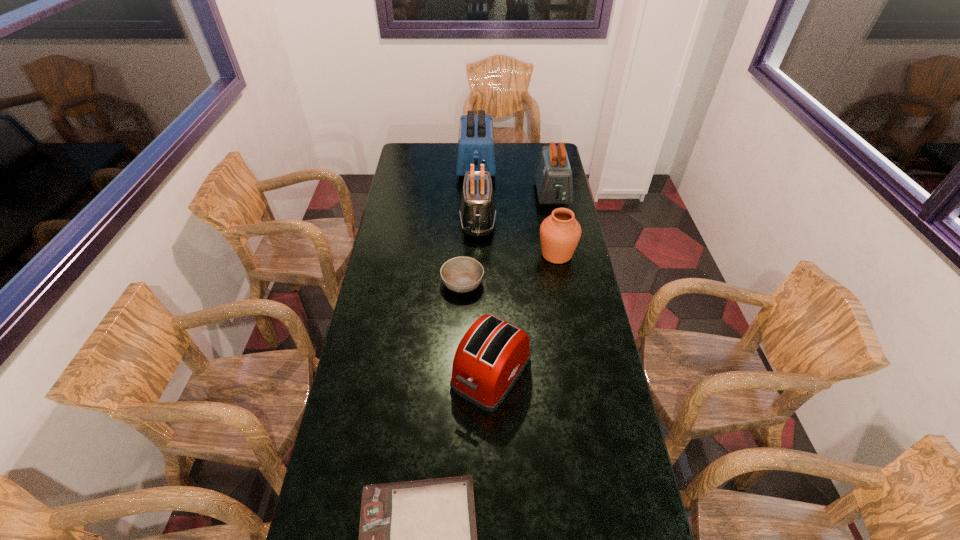
You are a GUI agent. You are given a task and a screenshot of the screen. Output one action in this format:
    pyautogui.click(x=<x>, y=<y>)
    Task: Click on the object that is at the far edge
    
    Given the screenshot: What is the action you would take?
    pyautogui.click(x=476, y=145)

Find the location of a particular element. toaster present at the right edge is located at coordinates (553, 176).

This screenshot has width=960, height=540. I want to click on urn that is positioned at the right edge, so click(560, 232).

Find the location of a particular element. vacant space at the left edge of the desktop is located at coordinates (341, 481).

The image size is (960, 540). What are the coordinates of `vacant point at the right edge` in the screenshot? It's located at (583, 329).

I want to click on empty space between the bowl and the urn, so click(x=510, y=268).

What are the coordinates of `object that is the fourth nearest to the urn` in the screenshot? It's located at (491, 356).

Identify which object is the third closest to the clipboard. Please provide its 2D coordinates. Your answer should be formatted as a tuple, i.e. [(x, y)], where the tuple contains the x and y coordinates of a point satisfying the conditions above.

[(560, 232)]

What are the coordinates of `toaster object that ranks as the third closest to the urn` in the screenshot? It's located at (491, 356).

The height and width of the screenshot is (540, 960). Find the location of `the closest toaster to the nearest object`. the closest toaster to the nearest object is located at coordinates (491, 356).